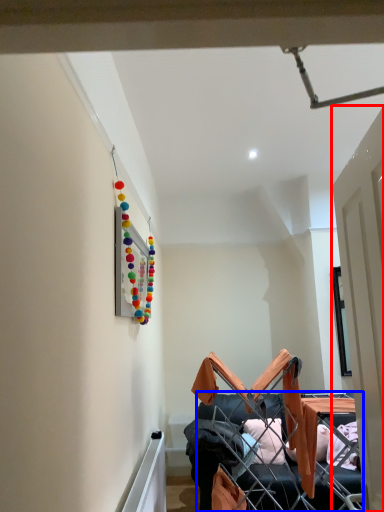
Question: Which point is closer to the camera, door (highlighted by a red box) or furniture (highlighted by a blue box)?

Choices:
 (A) door
 (B) furniture

Answer: (A)